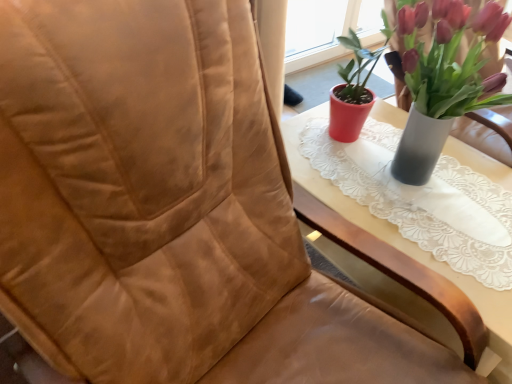
Find the location of `free space below matte red pot at upper right (from a real-world perspective)`. free space below matte red pot at upper right (from a real-world perspective) is located at coordinates (417, 183).